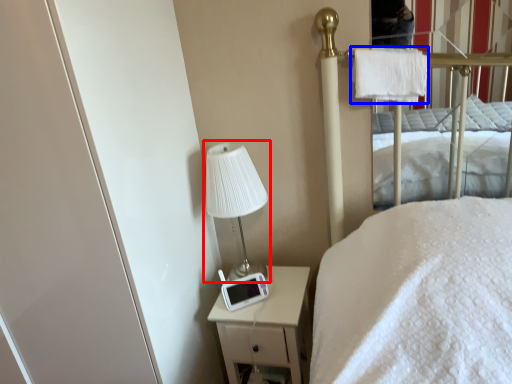
Question: Which point is further to the camera, table lamp (highlighted by a red box) or cloth (highlighted by a blue box)?

Choices:
 (A) table lamp
 (B) cloth

Answer: (A)